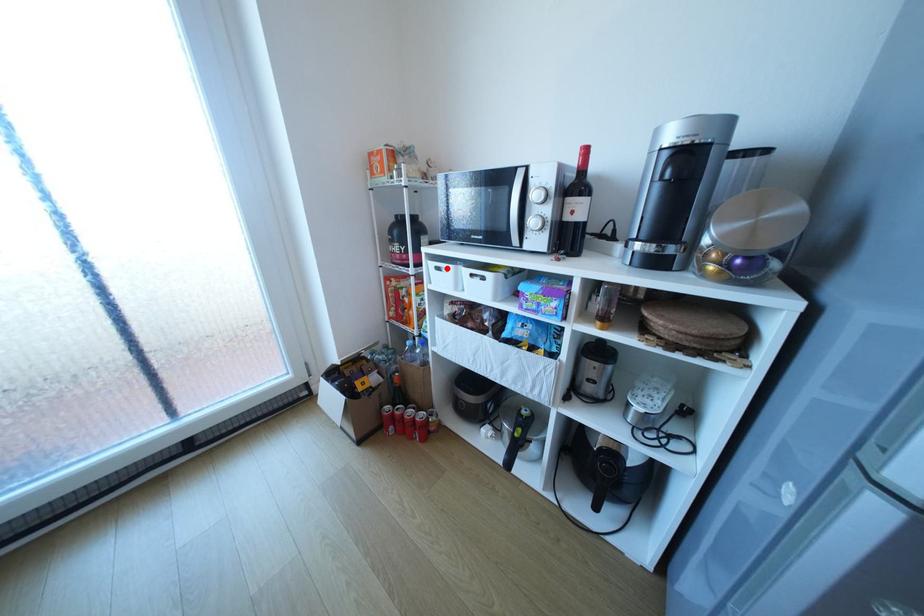
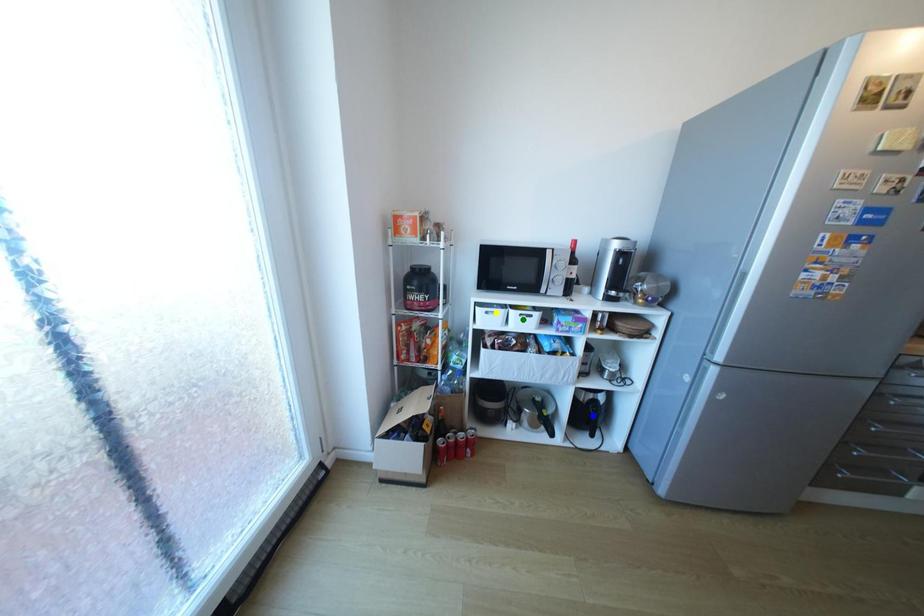
Question: I am providing you with two images of the same scene from different viewpoints. A red point is marked on the first image. You are given multiple points on the second image. Which mark in image 2 goes with the point in image 1?

Choices:
 (A) blue point
 (B) green point
 (C) yellow point

Answer: (C)